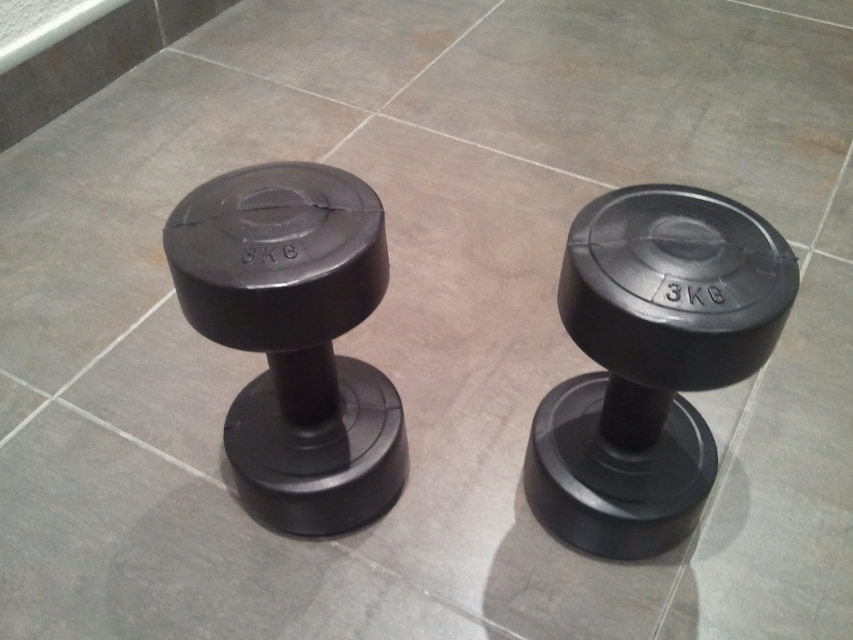
You are a fitness instructor preparing for a class. You need to arrange the matte black dumbbell at center and the matte black dumbbell at left so that the wider one is placed on the right side of the room. Based on the image, which dumbbell should you place on the right?

The matte black dumbbell at center might be wider than the matte black dumbbell at left, so you should place the matte black dumbbell at center on the right side of the room.

You are organizing a gym storage room and need to place the matte black dumbbell at center and the matte black dumbbell at left into a storage container that can only hold items up to 30 cm in height. Which dumbbell should you place first to ensure both fit?

The matte black dumbbell at center has a smaller size compared to matte black dumbbell at left. Therefore, you should place the larger matte black dumbbell at left first to ensure both fit into the container.